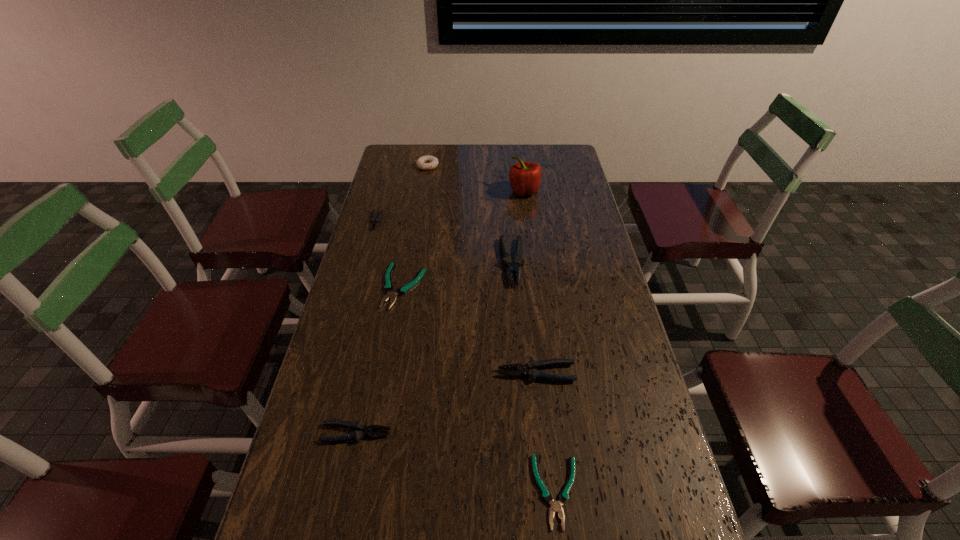
You are a GUI agent. You are given a task and a screenshot of the screen. Output one action in this format:
    pyautogui.click(x=<x>, y=<y>)
    Task: Click on the free point located 0.380m at the gripping part of the fifth shortest object
    
    Given the screenshot: What is the action you would take?
    pyautogui.click(x=358, y=373)

Find the location of a particular element. The image size is (960, 540). free spot located 0.400m at the gripping part of the fifth shortest object is located at coordinates (351, 373).

Where is `vacant space located at the gripping part of the seventh farthest object`? The image size is (960, 540). vacant space located at the gripping part of the seventh farthest object is located at coordinates (460, 433).

Find the location of a particular element. The width and height of the screenshot is (960, 540). vacant position located at the gripping part of the farthest pliers is located at coordinates (367, 255).

What are the coordinates of `free space located on the right of the bigger teal pliers` in the screenshot? It's located at (516, 287).

The width and height of the screenshot is (960, 540). Identify the location of vacant region located on the right of the right teal pliers. (652, 491).

The image size is (960, 540). I want to click on object positioned at the far edge, so click(x=427, y=162).

Where is `doughnut located at the left edge`? doughnut located at the left edge is located at coordinates (427, 162).

The image size is (960, 540). I want to click on object that is at the far left corner, so click(x=427, y=162).

In the image, there is a desktop. What are the coordinates of `vacant space at the far edge` in the screenshot? It's located at (435, 154).